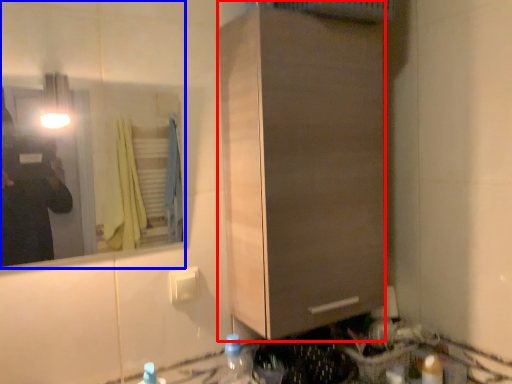
Question: Which point is further to the camera, cabinetry (highlighted by a red box) or mirror (highlighted by a blue box)?

Choices:
 (A) cabinetry
 (B) mirror

Answer: (A)